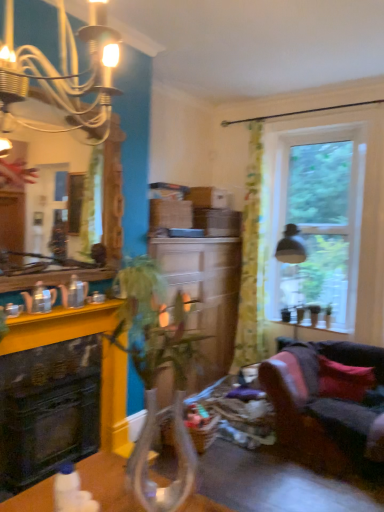
You are a GUI agent. You are given a task and a screenshot of the screen. Output one action in this format:
    pyautogui.click(x=<x>, y=<y>)
    Task: Click on the wooden mirror at upper left
    The height and width of the screenshot is (512, 384).
    Given the screenshot: What is the action you would take?
    pyautogui.click(x=113, y=194)

This screenshot has height=512, width=384. What do you see at coordinates (58, 327) in the screenshot?
I see `black glossy fireplace at left` at bounding box center [58, 327].

Measure the distance between point (x=256, y=300) and camera.

Point (x=256, y=300) and camera are 15.17 feet apart.

Identify the location of clear glass window at upper right. This screenshot has height=512, width=384. (315, 214).

What do you see at coordinates (315, 214) in the screenshot? I see `clear glass window at upper right` at bounding box center [315, 214].

Locate an element on the screen. The image size is (384, 512). green leafy plant at center is located at coordinates (155, 380).

Find the location of a particular element. yellow wood counter at left is located at coordinates (74, 316).

Which is closer, (117, 275) or (378, 355)?

Point (117, 275) is positioned closer to the camera compared to point (378, 355).

Is green leafy plant at center touching velvet dark grey couch at lower right?

No, green leafy plant at center is not making contact with velvet dark grey couch at lower right.

Which object is more forward, green leafy plant at center or velvet dark grey couch at lower right?

Positioned in front is green leafy plant at center.

Looking at this image, can we say green leafy plant at center lies outside velvet dark grey couch at lower right?

Yes, green leafy plant at center is located beyond the bounds of velvet dark grey couch at lower right.

Which is nearer, (x=168, y=330) or (x=91, y=316)?

Clearly, point (x=168, y=330) is closer to the camera than point (x=91, y=316).

From a real-world perspective, who is located higher, green leafy plant at center or yellow wood counter at left?

green leafy plant at center.

The width and height of the screenshot is (384, 512). In the image, there is a wooden mirror at upper left. Find the location of `houseplant below it (from a real-world perspective)`. houseplant below it (from a real-world perspective) is located at coordinates (155, 380).

Can you tell me how much wooden mirror at upper left and green leafy plant at center differ in facing direction?

They differ by 89.9 degrees in their facing directions.

Would you consider wooden mirror at upper left to be distant from green leafy plant at center?

That's not correct — wooden mirror at upper left is a little close to green leafy plant at center.

Consider the image. From the image's perspective, is wooden mirror at upper left located beneath green leafy plant at center?

Incorrect, from the image's perspective, wooden mirror at upper left is higher than green leafy plant at center.

From a real-world perspective, between yellow wood counter at left and wooden mirror at upper left, who is vertically lower?

yellow wood counter at left.

In the scene shown: Can you confirm if yellow wood counter at left is smaller than wooden mirror at upper left?

Indeed, yellow wood counter at left has a smaller size compared to wooden mirror at upper left.

From the image's perspective, which is above, yellow wood counter at left or wooden mirror at upper left?

wooden mirror at upper left, from the image's perspective.

Is yellow wood counter at left at the right side of wooden mirror at upper left?

No.

From a real-world perspective, is wooden mirror at upper left physically located above or below velvet dark grey couch at lower right?

Clearly, from a real-world perspective, wooden mirror at upper left is above velvet dark grey couch at lower right.

Measure the distance between wooden mirror at upper left and velvet dark grey couch at lower right.

A distance of 6.64 feet exists between wooden mirror at upper left and velvet dark grey couch at lower right.

Between wooden mirror at upper left and velvet dark grey couch at lower right, which one has larger width?

With larger width is velvet dark grey couch at lower right.

From their relative heights in the image, would you say wooden mirror at upper left is taller or shorter than velvet dark grey couch at lower right?

In the image, wooden mirror at upper left appears to be taller than velvet dark grey couch at lower right.

Considering the positions of points (113, 263) and (106, 426), is point (113, 263) closer to camera compared to point (106, 426)?

Yes, it is in front of point (106, 426).

Considering the relative positions of wooden mirror at upper left and black glossy fireplace at left in the image provided, is wooden mirror at upper left behind black glossy fireplace at left?

No.

Who is taller, wooden mirror at upper left or black glossy fireplace at left?

wooden mirror at upper left is taller.

From a real-world perspective, does wooden mirror at upper left sit lower than black glossy fireplace at left?

No, from a real-world perspective, wooden mirror at upper left is not below black glossy fireplace at left.

From a real-world perspective, which object stands above the other?

From a 3D spatial view, wooden mirror at upper left is above.

Considering the sizes of clear glass window at upper right and wooden mirror at upper left in the image, is clear glass window at upper right taller or shorter than wooden mirror at upper left?

In the image, clear glass window at upper right appears to be taller than wooden mirror at upper left.

Considering the positions of objects clear glass window at upper right and wooden mirror at upper left in the image provided, who is behind, clear glass window at upper right or wooden mirror at upper left?

clear glass window at upper right is further from the camera.

Considering the relative sizes of clear glass window at upper right and wooden mirror at upper left in the image provided, is clear glass window at upper right smaller than wooden mirror at upper left?

No, clear glass window at upper right is not smaller than wooden mirror at upper left.

The width and height of the screenshot is (384, 512). Identify the location of studio couch below the green leafy plant at center (from the image's perspective). (323, 408).

Identify the location of houseplant above the yellow wood counter at left (from a real-world perspective). (155, 380).

Considering their positions, is clear glass window at upper right positioned further to green leafy plant at center than pink fabric pillow at lower right?

Among the two, clear glass window at upper right is located further to green leafy plant at center.

Which object lies further to the anchor point yellow wood counter at left, velvet dark grey couch at lower right or clear glass window at upper right?

Among the two, clear glass window at upper right is located further to yellow wood counter at left.

Looking at the image, which one is located closer to pink fabric pillow at lower right, yellow wood counter at left or velvet dark grey couch at lower right?

velvet dark grey couch at lower right.

Estimate the real-world distances between objects in this image. Which object is closer to yellow wood counter at left, clear glass window at upper right or pink fabric pillow at lower right?

The object closer to yellow wood counter at left is pink fabric pillow at lower right.

Considering their positions, is velvet dark grey couch at lower right positioned closer to green leafy plant at center than wooden mirror at upper left?

wooden mirror at upper left lies closer to green leafy plant at center than the other object.

Based on their spatial positions, is yellow wood counter at left or wooden mirror at upper left further from clear glass window at upper right?

yellow wood counter at left lies further to clear glass window at upper right than the other object.

Based on the photo, estimate the real-world distances between objects in this image. Which object is closer to black glossy fireplace at left, yellow wood counter at left or wooden mirror at upper left?

yellow wood counter at left is closer to black glossy fireplace at left.

Looking at the image, which one is located further to clear glass window at upper right, wooden mirror at upper left or pink fabric pillow at lower right?

wooden mirror at upper left.

You are a GUI agent. You are given a task and a screenshot of the screen. Output one action in this format:
    pyautogui.click(x=<x>, y=<y>)
    Task: Click on the studio couch between green leafy plant at center and clear glass window at upper right from front to back
    
    Given the screenshot: What is the action you would take?
    pyautogui.click(x=323, y=408)

I want to click on mirror between green leafy plant at center and translucent floral fabric curtain at right in the front-back direction, so click(x=113, y=194).

The image size is (384, 512). I want to click on fireplace located between yellow wood counter at left and pink fabric pillow at lower right in the left-right direction, so click(x=58, y=327).

Where is `studio couch positioned between green leafy plant at center and pink fabric pillow at lower right from near to far`? This screenshot has height=512, width=384. studio couch positioned between green leafy plant at center and pink fabric pillow at lower right from near to far is located at coordinates (323, 408).